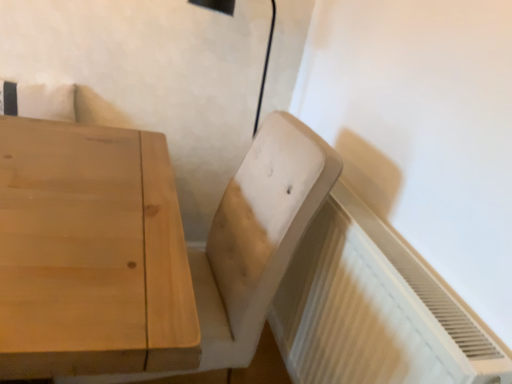
What is the approximate height of white textured radiator at lower right?

white textured radiator at lower right is 27.68 inches tall.

Identify the location of white textured radiator at lower right. (373, 309).

What do you see at coordinates (373, 309) in the screenshot? The height and width of the screenshot is (384, 512). I see `white textured radiator at lower right` at bounding box center [373, 309].

I want to click on light brown wood swivel chair at center, so click(257, 236).

What do you see at coordinates (257, 236) in the screenshot? This screenshot has width=512, height=384. I see `light brown wood swivel chair at center` at bounding box center [257, 236].

Where is `white textured radiator at lower right`? white textured radiator at lower right is located at coordinates coord(373,309).

Between white textured radiator at lower right and light brown wood swivel chair at center, which one appears on the left side from the viewer's perspective?

light brown wood swivel chair at center is more to the left.

In the image, is white textured radiator at lower right positioned in front of or behind light brown wood swivel chair at center?

Clearly, white textured radiator at lower right is in front of light brown wood swivel chair at center.

Does point (438, 347) come farther from viewer compared to point (262, 134)?

No, it is not.

From the image's perspective, relative to light brown wood swivel chair at center, is white textured radiator at lower right above or below?

white textured radiator at lower right is below light brown wood swivel chair at center.

From a real-world perspective, between white textured radiator at lower right and light brown wood swivel chair at center, who is vertically higher?

light brown wood swivel chair at center is physically above.

In terms of width, does white textured radiator at lower right look wider or thinner when compared to light brown wood swivel chair at center?

Clearly, white textured radiator at lower right has less width compared to light brown wood swivel chair at center.

Considering the sizes of objects white textured radiator at lower right and light brown wood swivel chair at center in the image provided, who is shorter, white textured radiator at lower right or light brown wood swivel chair at center?

Standing shorter between the two is white textured radiator at lower right.

Considering the sizes of objects white textured radiator at lower right and light brown wood swivel chair at center in the image provided, who is smaller, white textured radiator at lower right or light brown wood swivel chair at center?

Smaller between the two is white textured radiator at lower right.

Is white textured radiator at lower right surrounding light brown wood swivel chair at center?

Definitely not — light brown wood swivel chair at center is not inside white textured radiator at lower right.

Is white textured radiator at lower right far away from light brown wood swivel chair at center?

They are positioned close to each other.

Is white textured radiator at lower right positioned with its back to light brown wood swivel chair at center?

No, white textured radiator at lower right is not facing the opposite direction of light brown wood swivel chair at center.

How different are the orientations of white textured radiator at lower right and light brown wood swivel chair at center in degrees?

They differ by 3.7 degrees in their facing directions.

Could you measure the distance between white textured radiator at lower right and light brown wood swivel chair at center?

white textured radiator at lower right is 9.17 inches away from light brown wood swivel chair at center.

The image size is (512, 384). I want to click on radiator located on the right of light brown wood swivel chair at center, so click(373, 309).

Based on their positions, is light brown wood swivel chair at center located to the left or right of white textured radiator at lower right?

In the image, light brown wood swivel chair at center appears on the left side of white textured radiator at lower right.

Is light brown wood swivel chair at center positioned before white textured radiator at lower right?

No, light brown wood swivel chair at center is further to the viewer.

Considering the points (244, 310) and (409, 274), which point is in front, point (244, 310) or point (409, 274)?

The point (409, 274) is closer.

From the image's perspective, relative to white textured radiator at lower right, is light brown wood swivel chair at center above or below?

Clearly, from the image's perspective, light brown wood swivel chair at center is above white textured radiator at lower right.

From a real-world perspective, is light brown wood swivel chair at center located beneath white textured radiator at lower right?

No, from a real-world perspective, light brown wood swivel chair at center is not under white textured radiator at lower right.

Which object is thinner, light brown wood swivel chair at center or white textured radiator at lower right?

With smaller width is white textured radiator at lower right.

Considering the relative sizes of light brown wood swivel chair at center and white textured radiator at lower right in the image provided, is light brown wood swivel chair at center shorter than white textured radiator at lower right?

No, light brown wood swivel chair at center is not shorter than white textured radiator at lower right.

Does light brown wood swivel chair at center have a larger size compared to white textured radiator at lower right?

Indeed, light brown wood swivel chair at center has a larger size compared to white textured radiator at lower right.

Is light brown wood swivel chair at center situated inside white textured radiator at lower right or outside?

light brown wood swivel chair at center is spatially situated outside white textured radiator at lower right.

Does light brown wood swivel chair at center touch white textured radiator at lower right?

No, light brown wood swivel chair at center is not making contact with white textured radiator at lower right.

Is light brown wood swivel chair at center oriented towards white textured radiator at lower right?

No.

Can you tell me how much light brown wood swivel chair at center and white textured radiator at lower right differ in facing direction?

The facing directions of light brown wood swivel chair at center and white textured radiator at lower right are 3.7 degrees apart.

The width and height of the screenshot is (512, 384). I want to click on radiator that appears in front of the light brown wood swivel chair at center, so click(373, 309).

In order to click on swivel chair behind the white textured radiator at lower right in this screenshot , I will do `click(257, 236)`.

Where is `radiator in front of the light brown wood swivel chair at center`? Image resolution: width=512 pixels, height=384 pixels. radiator in front of the light brown wood swivel chair at center is located at coordinates (373, 309).